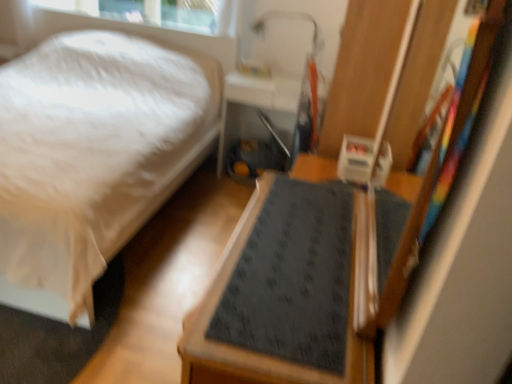
Question: Is metallic silver tray at center inside the boundaries of white soft bed at lower left, or outside?

Choices:
 (A) inside
 (B) outside

Answer: (B)

Question: From a real-world perspective, is metallic silver tray at center above or below white soft bed at lower left?

Choices:
 (A) above
 (B) below

Answer: (B)

Question: Which object is the closest to the metallic silver tray at center?

Choices:
 (A) white soft bed at lower left
 (B) dark gray textured mat at center

Answer: (A)

Question: Which is nearer to the white soft bed at lower left?

Choices:
 (A) metallic silver tray at center
 (B) dark gray textured mat at center

Answer: (A)